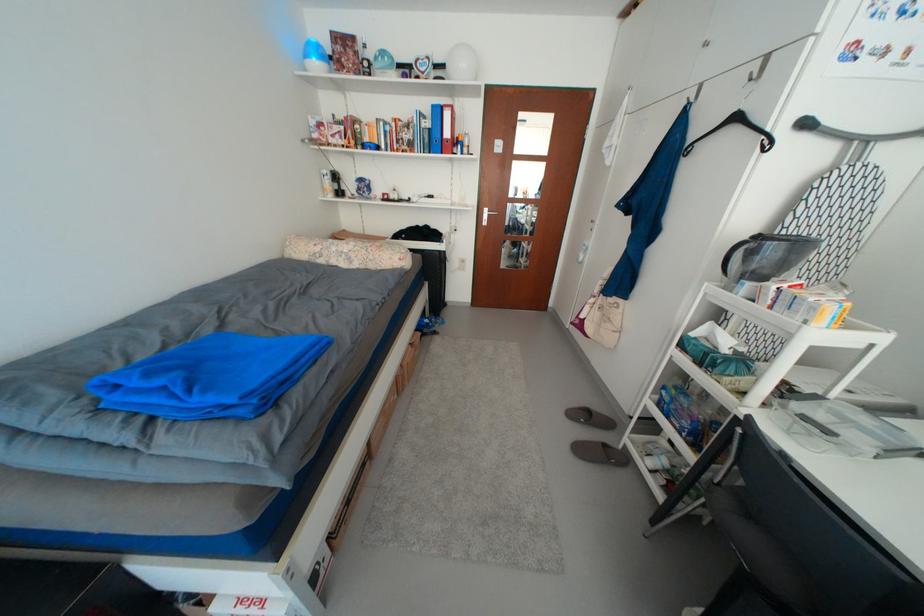
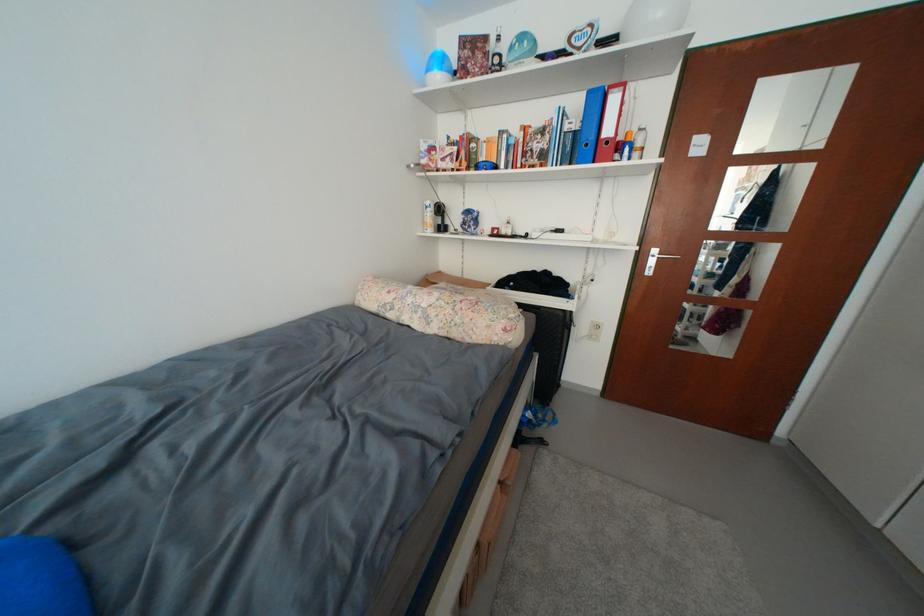
Locate, in the second image, the point that corresponds to (x=408, y=262) in the first image.

(514, 331)